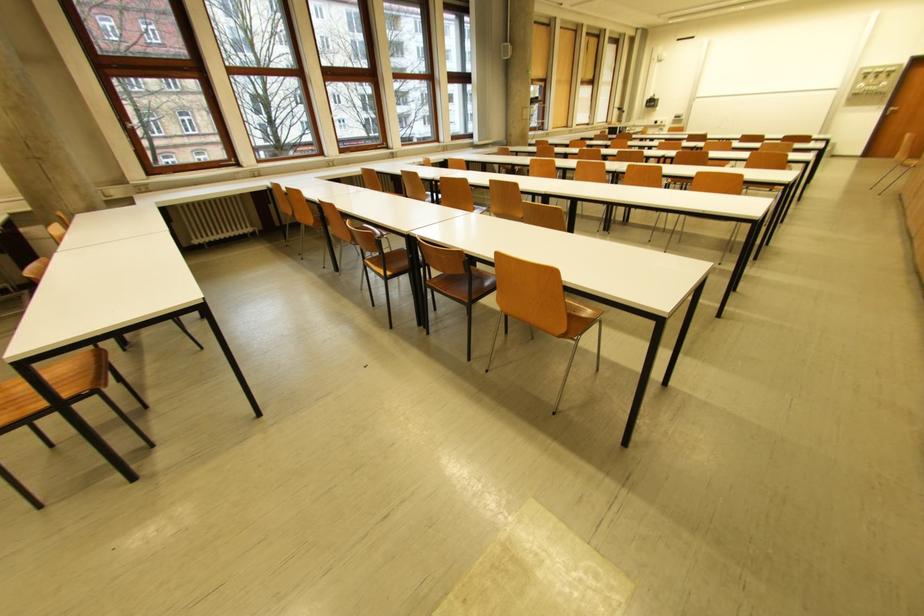
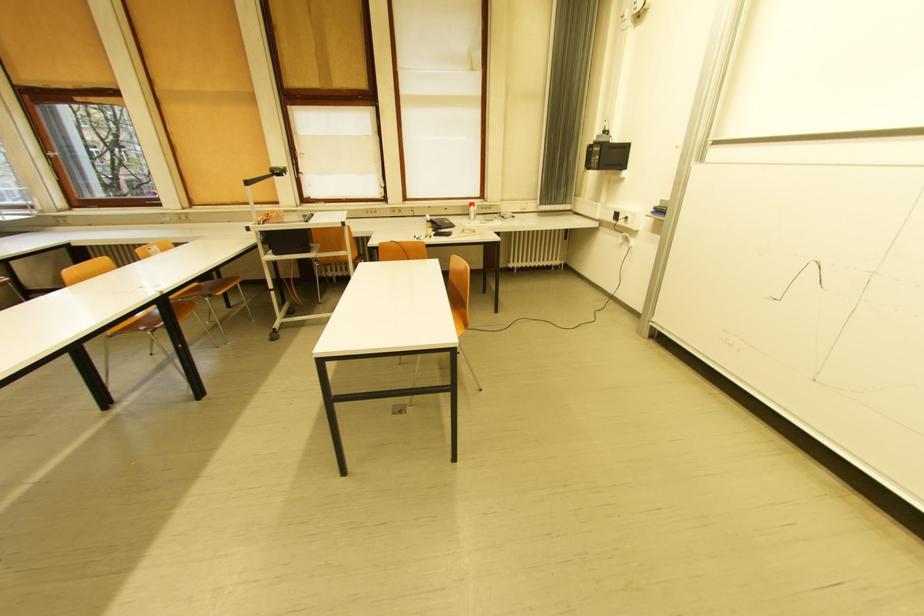
Find the pixel in the second image that matches (651,108) in the first image.

(592, 168)